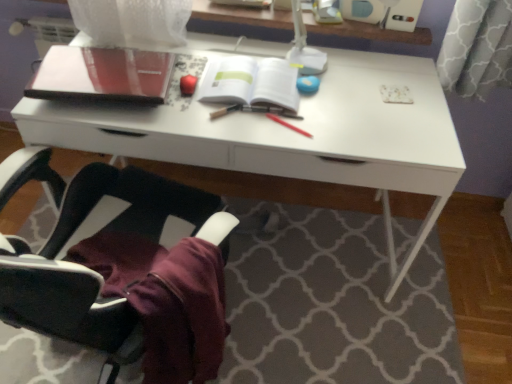
What are the coordinates of `vacant point to the right of red matte pen at center, which is the first stationery from right to left` in the screenshot? It's located at (344, 129).